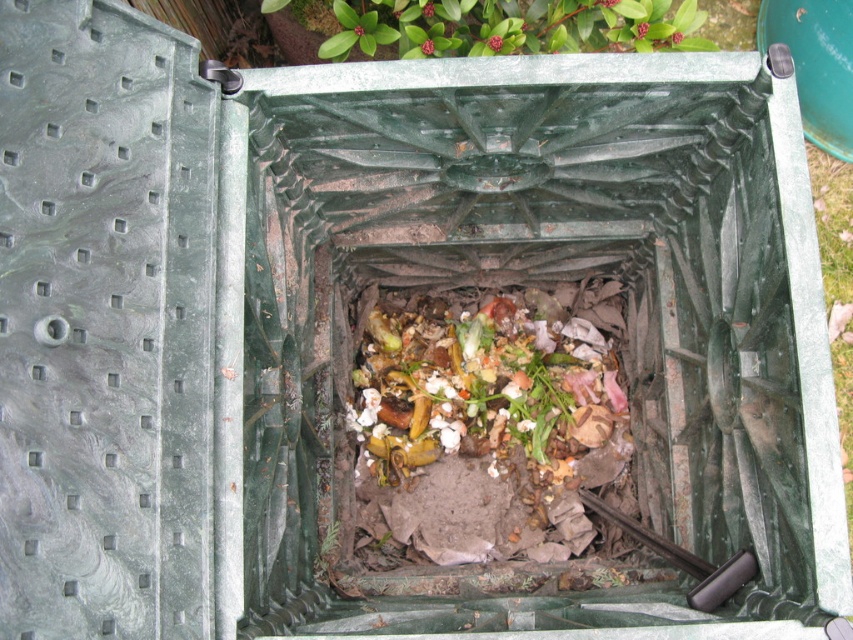
Who is lower down, brown crumbly food at center or green leafy plant at upper center?

brown crumbly food at center is lower down.

Can you confirm if brown crumbly food at center is shorter than green leafy plant at upper center?

No.

Between point (374, 433) and point (669, 42), which one is positioned in front?

Point (669, 42) is in front.

Locate an element on the screen. brown crumbly food at center is located at coordinates (485, 387).